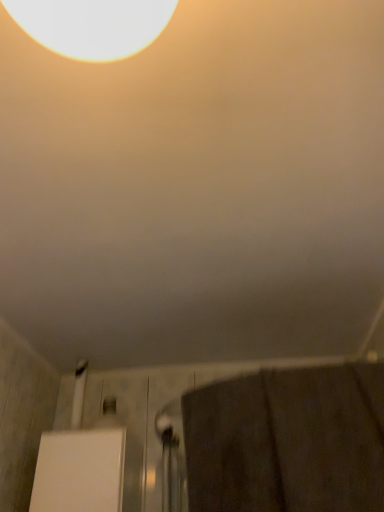
What is the approximate height of brown textured towel at lower right?

brown textured towel at lower right is 33.74 centimeters in height.

This screenshot has width=384, height=512. Describe the element at coordinates (287, 441) in the screenshot. I see `brown textured towel at lower right` at that location.

You are a GUI agent. You are given a task and a screenshot of the screen. Output one action in this format:
    pyautogui.click(x=<x>, y=<y>)
    Task: Click on the brown textured towel at lower right
    This screenshot has width=384, height=512.
    Given the screenshot: What is the action you would take?
    pyautogui.click(x=287, y=441)

Measure the distance between brown textured towel at lower right and camera.

32.55 inches.

Locate an element on the screen. white glossy lampshade at upper left is located at coordinates (92, 25).

Measure the distance between point (101, 13) and camera.

Point (101, 13) is 19.41 inches from camera.

What do you see at coordinates (92, 25) in the screenshot? I see `white glossy lampshade at upper left` at bounding box center [92, 25].

In order to face white glossy lampshade at upper left, should I rotate leftwards or rightwards?

Turn left by 13.015 degrees to look at white glossy lampshade at upper left.

At what (x,y) coordinates should I click in order to perform the action: click on brown textured towel at lower right. Please return your answer as a coordinate pair (x, y). The height and width of the screenshot is (512, 384). Looking at the image, I should click on (287, 441).

Considering the positions of objects white glossy lampshade at upper left and brown textured towel at lower right in the image provided, who is more to the right, white glossy lampshade at upper left or brown textured towel at lower right?

brown textured towel at lower right is more to the right.

Looking at this image, considering the positions of objects white glossy lampshade at upper left and brown textured towel at lower right in the image provided, who is behind, white glossy lampshade at upper left or brown textured towel at lower right?

brown textured towel at lower right.

Considering the points (140, 42) and (370, 439), which point is in front, point (140, 42) or point (370, 439)?

The point (140, 42) is closer to the camera.

From the image's perspective, does white glossy lampshade at upper left appear lower than brown textured towel at lower right?

Actually, white glossy lampshade at upper left appears above brown textured towel at lower right in the image.

From a real-world perspective, which is physically above, white glossy lampshade at upper left or brown textured towel at lower right?

white glossy lampshade at upper left, from a real-world perspective.

Which of these two, white glossy lampshade at upper left or brown textured towel at lower right, is thinner?

With smaller width is white glossy lampshade at upper left.

Based on the photo, does white glossy lampshade at upper left have a greater height compared to brown textured towel at lower right?

No, white glossy lampshade at upper left is not taller than brown textured towel at lower right.

Considering the sizes of white glossy lampshade at upper left and brown textured towel at lower right in the image, is white glossy lampshade at upper left bigger or smaller than brown textured towel at lower right?

white glossy lampshade at upper left is smaller than brown textured towel at lower right.

Consider the image. Can we say white glossy lampshade at upper left lies outside brown textured towel at lower right?

Yes, white glossy lampshade at upper left is outside of brown textured towel at lower right.

Is white glossy lampshade at upper left positioned far away from brown textured towel at lower right?

They are positioned close to each other.

Does white glossy lampshade at upper left turn towards brown textured towel at lower right?

No, white glossy lampshade at upper left is not oriented towards brown textured towel at lower right.

Can you tell me how much white glossy lampshade at upper left and brown textured towel at lower right differ in facing direction?

They differ by 90.5 degrees in their facing directions.

What are the coordinates of `lamp located on the left of brown textured towel at lower right` in the screenshot? It's located at [92, 25].

Is brown textured towel at lower right at the left side of white glossy lampshade at upper left?

No, brown textured towel at lower right is not to the left of white glossy lampshade at upper left.

Relative to white glossy lampshade at upper left, is brown textured towel at lower right in front or behind?

Clearly, brown textured towel at lower right is behind white glossy lampshade at upper left.

Does point (341, 425) come behind point (11, 9)?

That is True.

From the image's perspective, which one is positioned higher, brown textured towel at lower right or white glossy lampshade at upper left?

white glossy lampshade at upper left.

From a real-world perspective, which is physically below, brown textured towel at lower right or white glossy lampshade at upper left?

In real-world perspective, brown textured towel at lower right is lower.

Considering the sizes of brown textured towel at lower right and white glossy lampshade at upper left in the image, is brown textured towel at lower right wider or thinner than white glossy lampshade at upper left?

brown textured towel at lower right is wider than white glossy lampshade at upper left.

In terms of height, does brown textured towel at lower right look taller or shorter compared to white glossy lampshade at upper left?

Considering their sizes, brown textured towel at lower right has more height than white glossy lampshade at upper left.

Considering the sizes of objects brown textured towel at lower right and white glossy lampshade at upper left in the image provided, who is smaller, brown textured towel at lower right or white glossy lampshade at upper left?

white glossy lampshade at upper left.

Is brown textured towel at lower right not inside white glossy lampshade at upper left?

brown textured towel at lower right lies outside white glossy lampshade at upper left's area.

Is brown textured towel at lower right not near white glossy lampshade at upper left?

brown textured towel at lower right is actually quite close to white glossy lampshade at upper left.

Is white glossy lampshade at upper left at the back of brown textured towel at lower right?

brown textured towel at lower right does not have its back to white glossy lampshade at upper left.

Consider the image. How many degrees apart are the facing directions of brown textured towel at lower right and white glossy lampshade at upper left?

There is a 90.5-degree angle between the facing directions of brown textured towel at lower right and white glossy lampshade at upper left.

Image resolution: width=384 pixels, height=512 pixels. In order to click on bath towel on the right of the white glossy lampshade at upper left in this screenshot , I will do `click(287, 441)`.

You are a GUI agent. You are given a task and a screenshot of the screen. Output one action in this format:
    pyautogui.click(x=<x>, y=<y>)
    Task: Click on the bath towel behind the white glossy lampshade at upper left
    This screenshot has height=512, width=384.
    Given the screenshot: What is the action you would take?
    tap(287, 441)

This screenshot has width=384, height=512. Identify the location of lamp above the brown textured towel at lower right (from a real-world perspective). (92, 25).